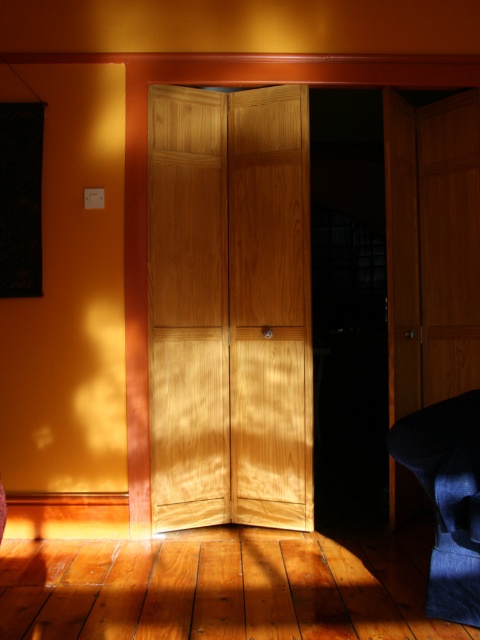
Which is more to the left, light brown wood door at center or denim fabric armchair at lower right?

light brown wood door at center is more to the left.

Who is taller, light brown wood door at center or denim fabric armchair at lower right?

With more height is light brown wood door at center.

You are a GUI agent. You are given a task and a screenshot of the screen. Output one action in this format:
    pyautogui.click(x=<x>, y=<y>)
    Task: Click on the light brown wood door at center
    
    Given the screenshot: What is the action you would take?
    pyautogui.click(x=229, y=307)